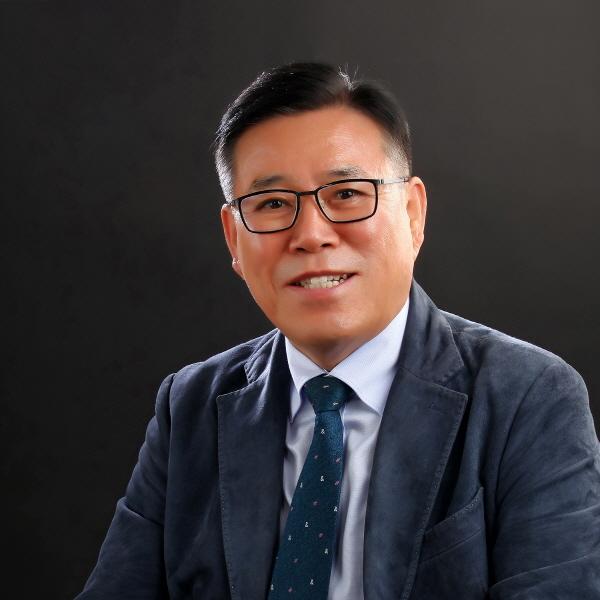
Locate an element on the screen. This screenshot has height=600, width=600. velvet is located at coordinates (144, 523).